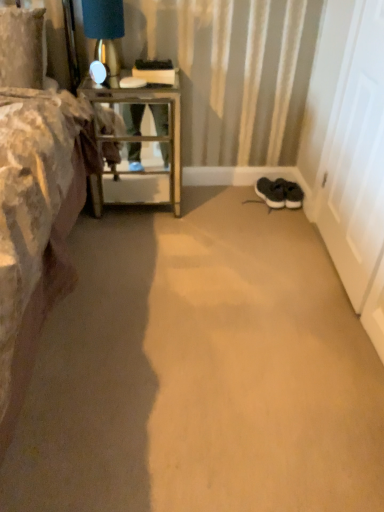
The image size is (384, 512). What are the coordinates of `free spot in front of metallic glass table at left` in the screenshot? It's located at (135, 242).